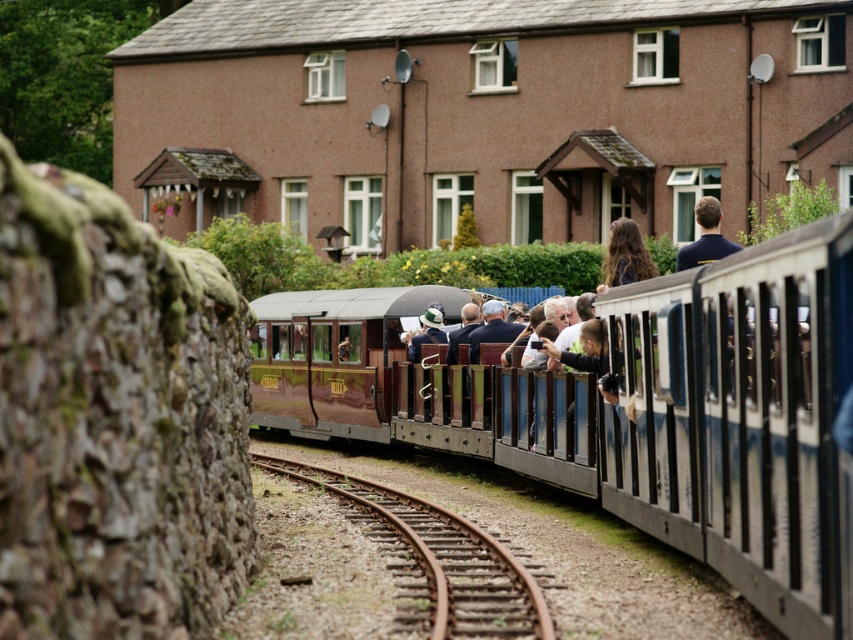
Question: Observing the image, what is the correct spatial positioning of long brown hair at upper center in reference to green fabric hat at center?

Choices:
 (A) left
 (B) right

Answer: (B)

Question: Can you confirm if polished wood train car at center is positioned below rusty metal train track at lower center?

Choices:
 (A) no
 (B) yes

Answer: (A)

Question: Is mahogany polished wood train at center positioned behind long brown hair at upper center?

Choices:
 (A) no
 (B) yes

Answer: (A)

Question: Estimate the real-world distances between objects in this image. Which object is closer to the mahogany polished wood train at center?

Choices:
 (A) green fabric hat at center
 (B) light brown wooden fence at center

Answer: (A)

Question: Which object is closer to the camera taking this photo?

Choices:
 (A) dark blue shirt at upper right
 (B) polished wood train car at center
 (C) rusty metal train track at lower center

Answer: (C)

Question: Considering the real-world distances, which object is closest to the long brown hair at upper center?

Choices:
 (A) light brown wooden fence at center
 (B) green fabric hat at center
 (C) mahogany polished wood train at center

Answer: (A)